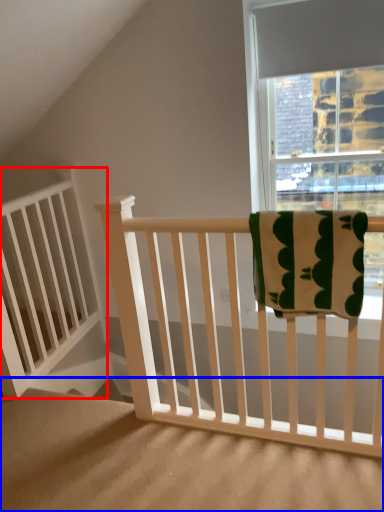
Question: Which object is further to the camera taking this photo, balustrade (highlighted by a red box) or stairs (highlighted by a blue box)?

Choices:
 (A) balustrade
 (B) stairs

Answer: (A)